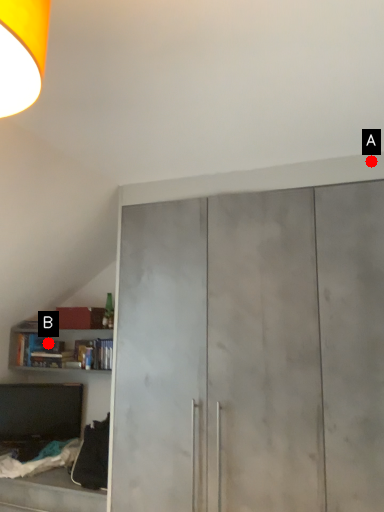
Question: Two points are circled on the image, labeled by A and B beside each circle. Which point is closer to the camera taking this photo?

Choices:
 (A) A is closer
 (B) B is closer

Answer: (A)